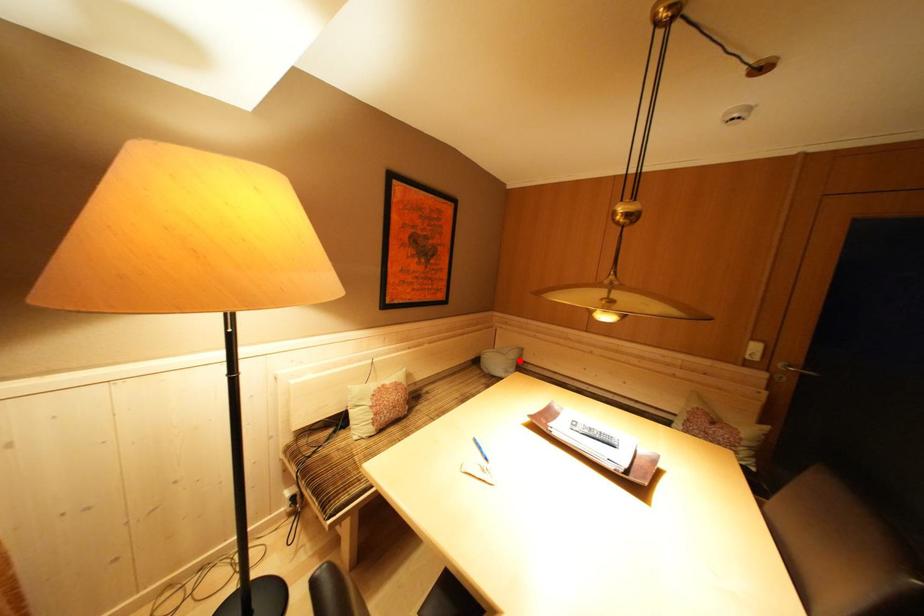
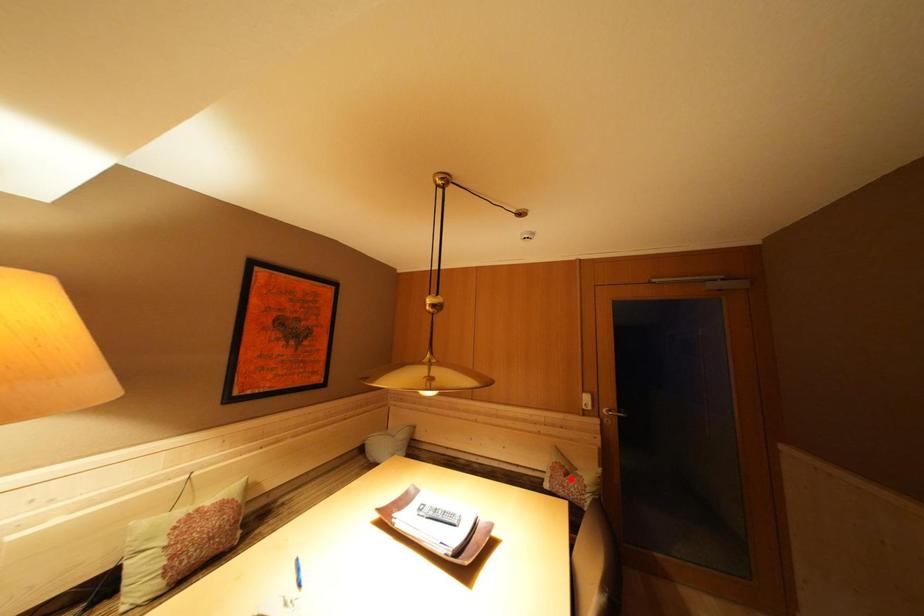
I am providing you with two images of the same scene from different viewpoints. A red point is marked on the first image and another point is marked on the second image. Does the point marked in image1 correspond to the same location as the one in image2?

No